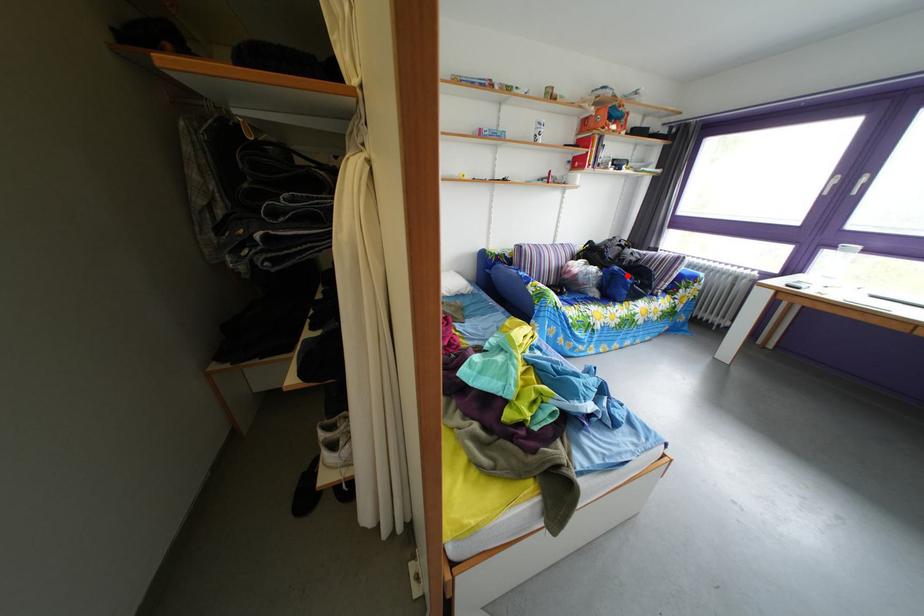
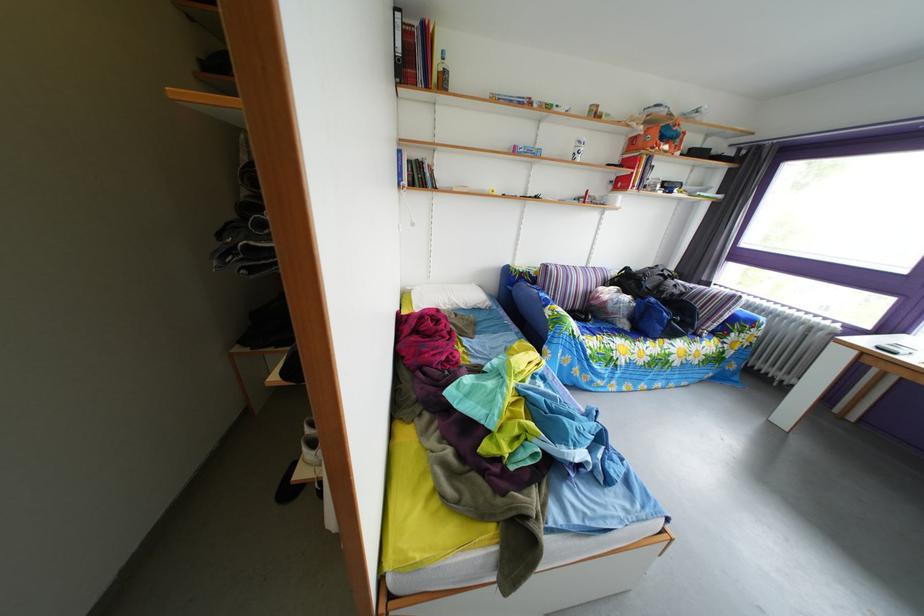
Find the pixel in the second image that matches the highlighted location in the first image.

(663, 307)